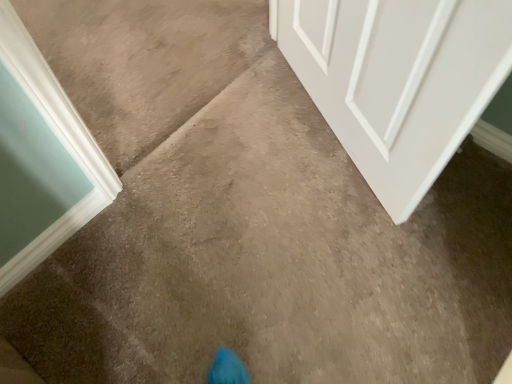
This screenshot has height=384, width=512. Identify the location of white glossy door at upper right. (399, 80).

In order to face white glossy door at upper right, should I rotate leftwards or rightwards?

You should look right and rotate roughly 12.874 degrees.

What do you see at coordinates (399, 80) in the screenshot?
I see `white glossy door at upper right` at bounding box center [399, 80].

Identify the location of white glossy door at upper right. (399, 80).